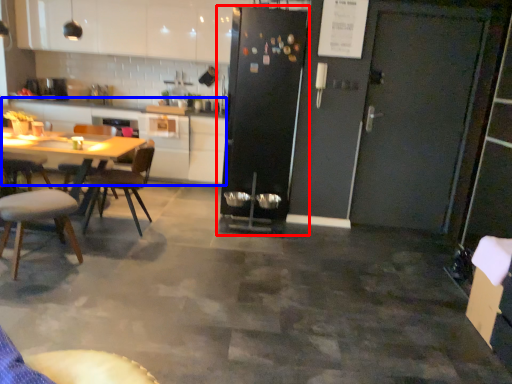
Question: Which of the following is the farthest to the observer, refrigerator (highlighted by a red box) or counter top (highlighted by a blue box)?

Choices:
 (A) refrigerator
 (B) counter top

Answer: (B)